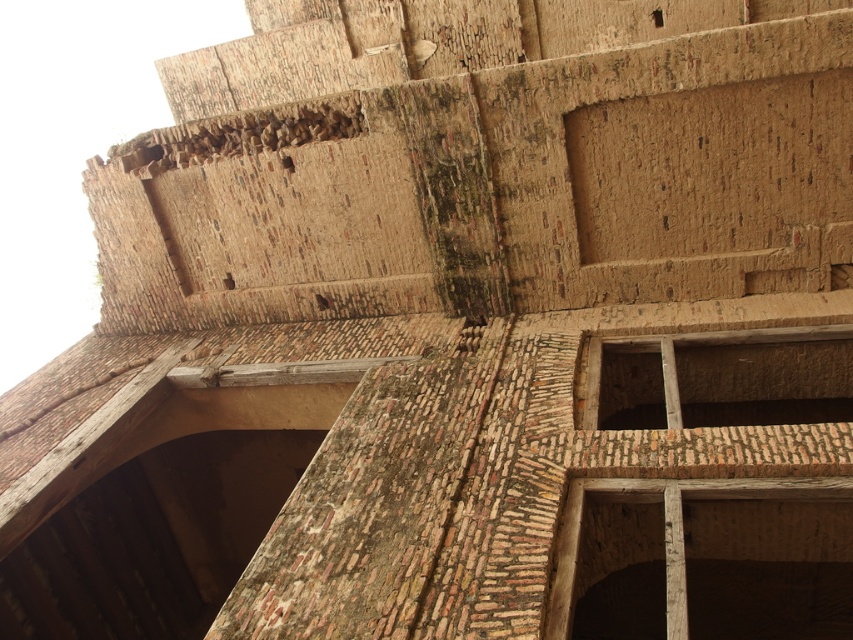
Question: Among these objects, which one is nearest to the camera?

Choices:
 (A) brown wooden window at lower right
 (B) wooden frame at upper center

Answer: (A)

Question: Which point is closer to the camera taking this photo?

Choices:
 (A) (563, 536)
 (B) (599, 356)

Answer: (A)

Question: Can you confirm if wooden frame at upper center is smaller than brown wooden window at lower right?

Choices:
 (A) yes
 (B) no

Answer: (B)

Question: Can you confirm if wooden frame at upper center is positioned to the left of brown wooden window at lower right?

Choices:
 (A) no
 (B) yes

Answer: (A)

Question: Does wooden frame at upper center appear under brown wooden window at lower right?

Choices:
 (A) no
 (B) yes

Answer: (A)